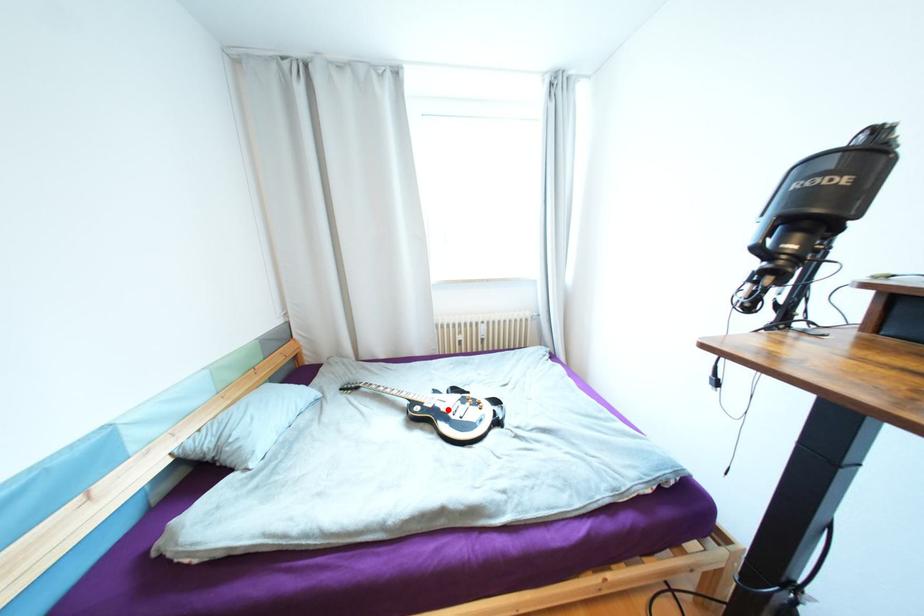
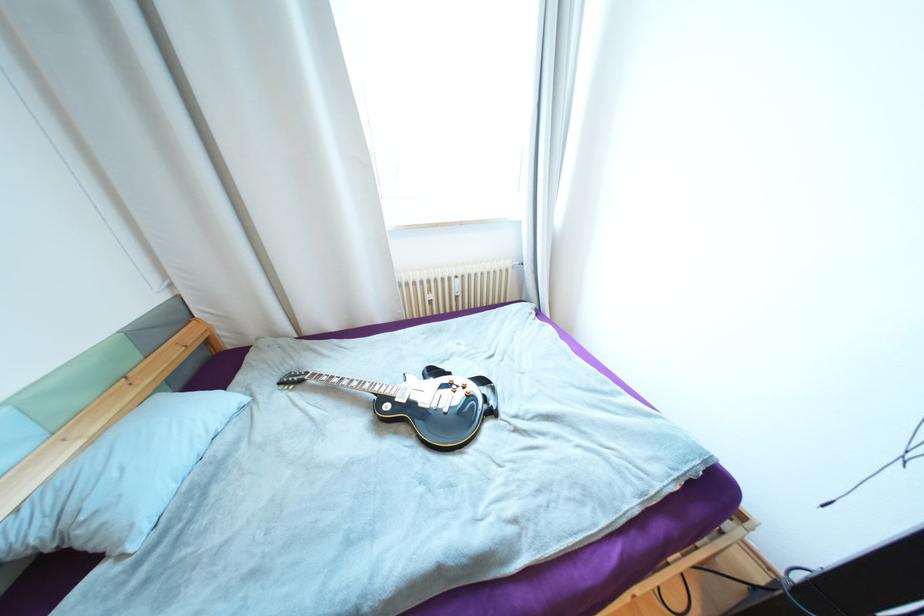
Find the pixel in the second image that matches the highlighted location in the first image.

(426, 405)